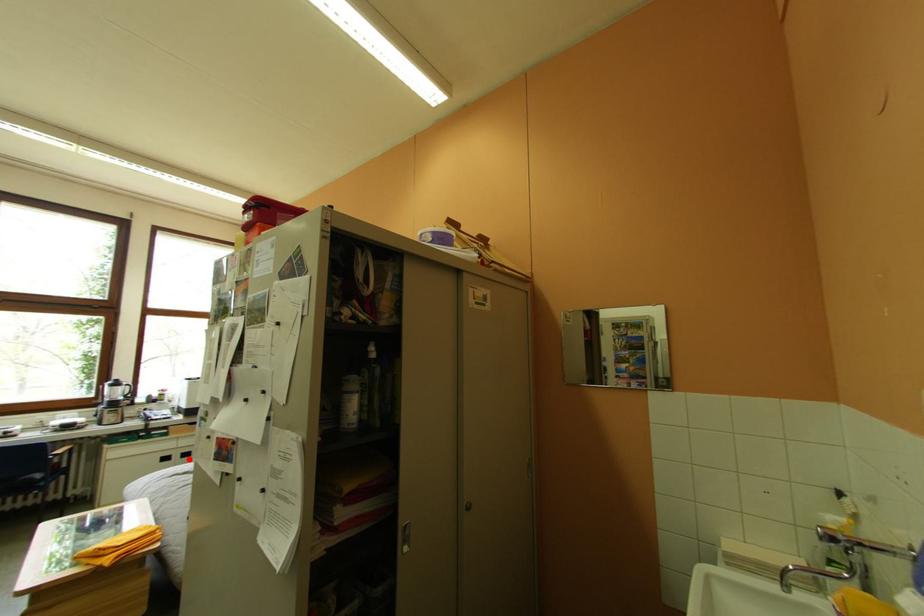
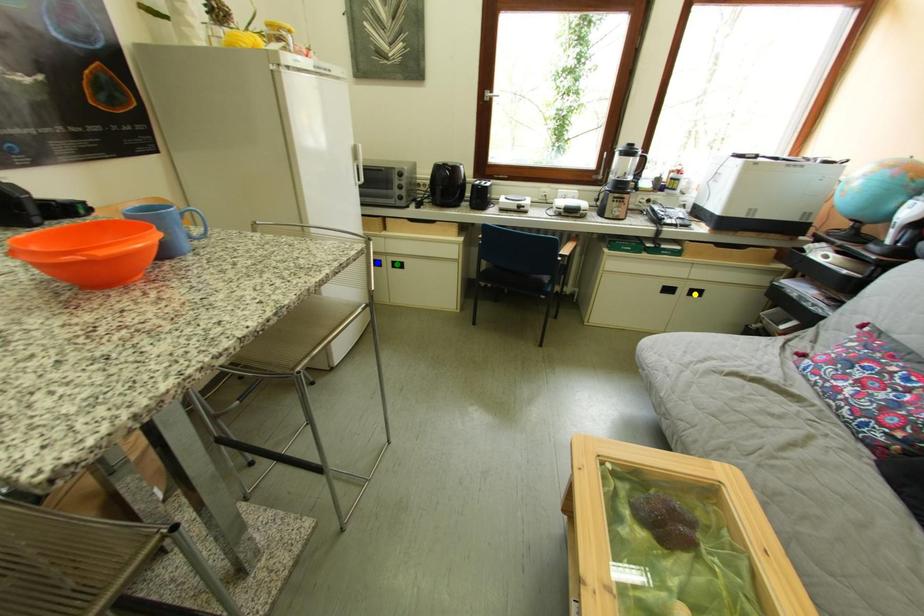
Question: I am providing you with two images of the same scene from different viewpoints. A red point is marked on the first image. You are given multiple points on the second image. Can you choose the point in image 2 that corresponds to the point in image 1?

Choices:
 (A) green point
 (B) blue point
 (C) yellow point

Answer: (C)